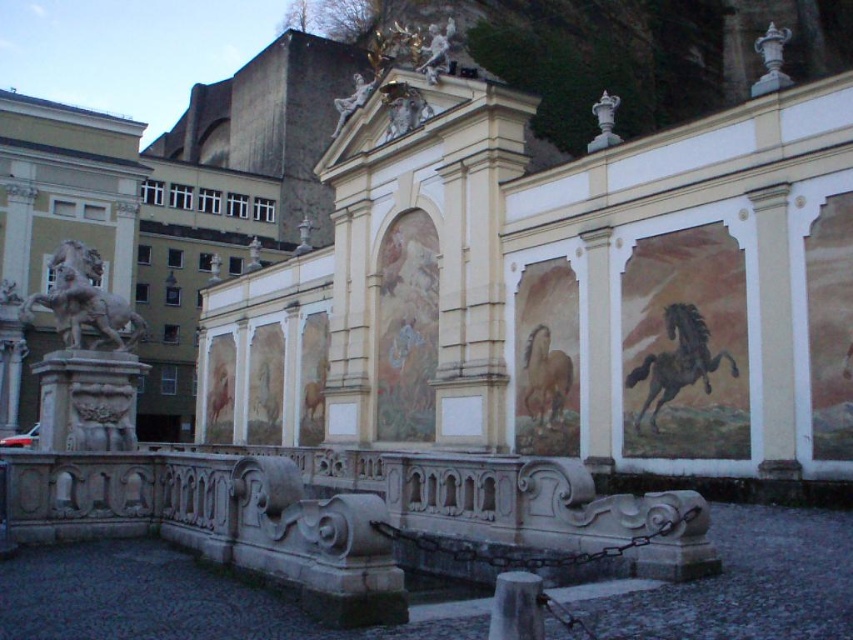
Does white marble horse at left have a larger size compared to light brown painted horse at center?

Yes.

Which is in front, point (76, 289) or point (222, 388)?

Point (76, 289) is in front.

What are the coordinates of `white marble horse at left` in the screenshot? It's located at (85, 301).

Does white marble horse at left have a greater width compared to white marble statue at upper center?

Indeed, white marble horse at left has a greater width compared to white marble statue at upper center.

Does point (68, 301) come farther from viewer compared to point (450, 44)?

No, it is in front of (450, 44).

The width and height of the screenshot is (853, 640). Identify the location of white marble horse at left. (85, 301).

Who is more forward, (532, 364) or (450, 36)?

Point (532, 364) is in front.

This screenshot has height=640, width=853. Describe the element at coordinates (544, 378) in the screenshot. I see `golden metallic horse at center` at that location.

The height and width of the screenshot is (640, 853). In order to click on golden metallic horse at center in this screenshot , I will do click(544, 378).

This screenshot has width=853, height=640. What are the coordinates of `golden metallic horse at center` in the screenshot? It's located at (544, 378).